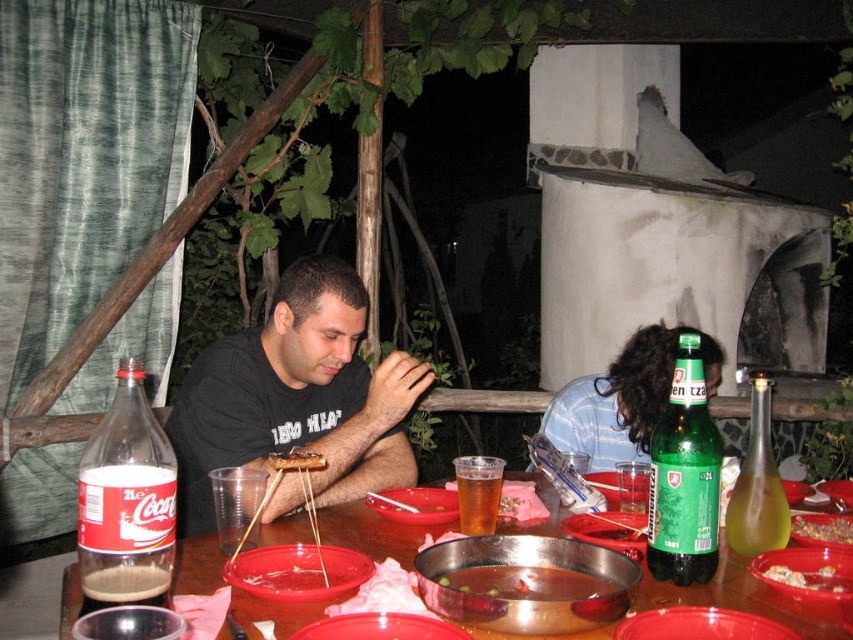
You are a guest at this outdoor dinner and want to grab the brown crumbly bread at center to dip into the smooth plastic bowl at center. Can you reach the bread without moving the bowl?

The brown crumbly bread at center is above the smooth plastic bowl at center, so you can reach the bread without moving the bowl since it is positioned over the bowl.

You are a photographer trying to capture a closeup shot of the items on the table. You notice two points of interest marked as point 1 at coordinates point [660,436] and point 2 at coordinates point [828,531]. Which point should you focus on to ensure the closest subject is in sharp focus?

Point [660,436] is closer to the camera than point [828,531], so focusing on point 1 will ensure the closest subject is in sharp focus.

You are a photographer taking a picture of the table in the dining scene. You want to focus on the green glass bottle at upper right. Where should you position your camera to capture it clearly?

Position the camera near the upper right area of the table to clearly capture the green glass bottle at upper right, which is located at point coordinates approximately 0.744 on the x and 0.803 on the y axis.